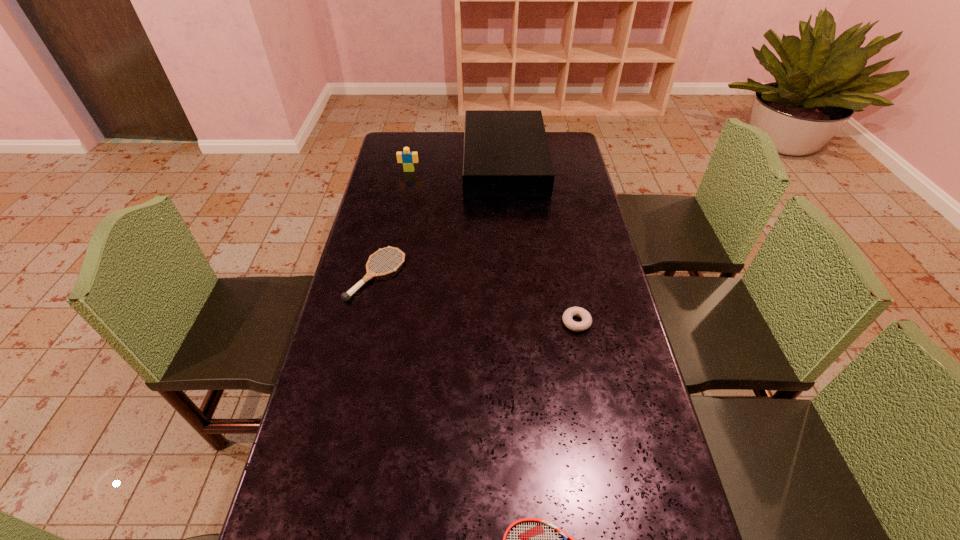
This screenshot has height=540, width=960. In order to click on free space between the doughnut and the Lego in this screenshot , I will do `click(492, 246)`.

At what (x,y) coordinates should I click in order to perform the action: click on unoccupied area between the fourth farthest object and the Lego. Please return your answer as a coordinate pair (x, y). This screenshot has height=540, width=960. Looking at the image, I should click on [x=492, y=246].

This screenshot has width=960, height=540. In order to click on vacant point located between the doughnut and the CD player in this screenshot , I will do `click(540, 242)`.

Locate an element on the screen. free spot between the doughnut and the Lego is located at coordinates (492, 246).

At what (x,y) coordinates should I click in order to perform the action: click on empty location between the Lego and the left tennis racket. Please return your answer as a coordinate pair (x, y). The width and height of the screenshot is (960, 540). Looking at the image, I should click on (393, 223).

The height and width of the screenshot is (540, 960). What are the coordinates of `object that is the closest to the CD player` in the screenshot? It's located at (408, 158).

Point out which object is positioned as the fourth nearest to the CD player. Please provide its 2D coordinates. Your answer should be formatted as a tuple, i.e. [(x, y)], where the tuple contains the x and y coordinates of a point satisfying the conditions above.

[(529, 539)]

Find the location of a particular element. vacant area in the image that satisfies the following two spatial constraints: 1. at the front of the CD player for disc insertion; 2. on the face of the Lego is located at coordinates (505, 171).

You are a GUI agent. You are given a task and a screenshot of the screen. Output one action in this format:
    pyautogui.click(x=<x>, y=<y>)
    Task: Click on the free space that satisfies the following two spatial constraints: 1. on the back side of the doughnut; 2. at the front of the CD player for disc insertion
    This screenshot has width=960, height=540.
    Given the screenshot: What is the action you would take?
    pyautogui.click(x=545, y=163)

Image resolution: width=960 pixels, height=540 pixels. Find the location of `vacant space that satisfies the following two spatial constraints: 1. at the front of the CD player for disc insertion; 2. on the back side of the second nearest object`. vacant space that satisfies the following two spatial constraints: 1. at the front of the CD player for disc insertion; 2. on the back side of the second nearest object is located at coordinates (516, 322).